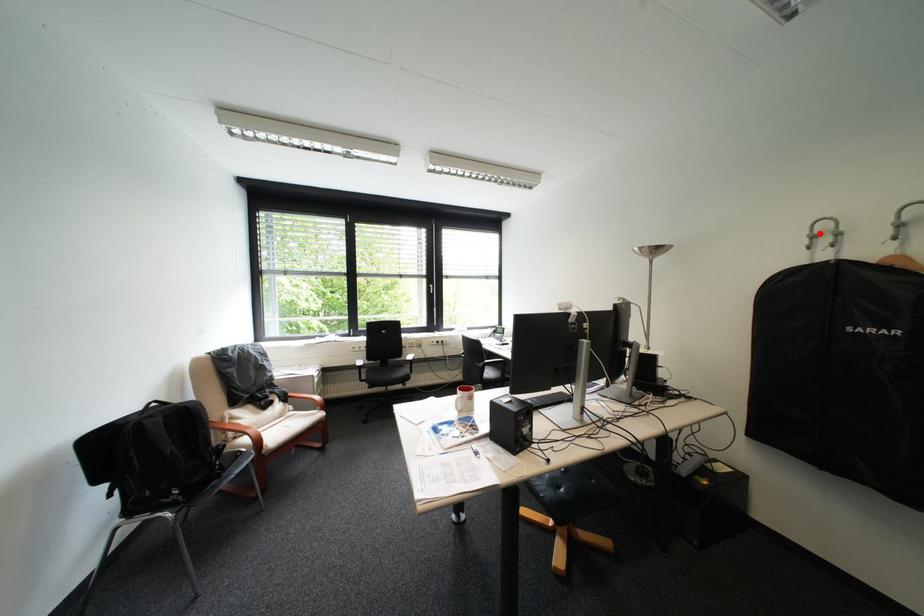
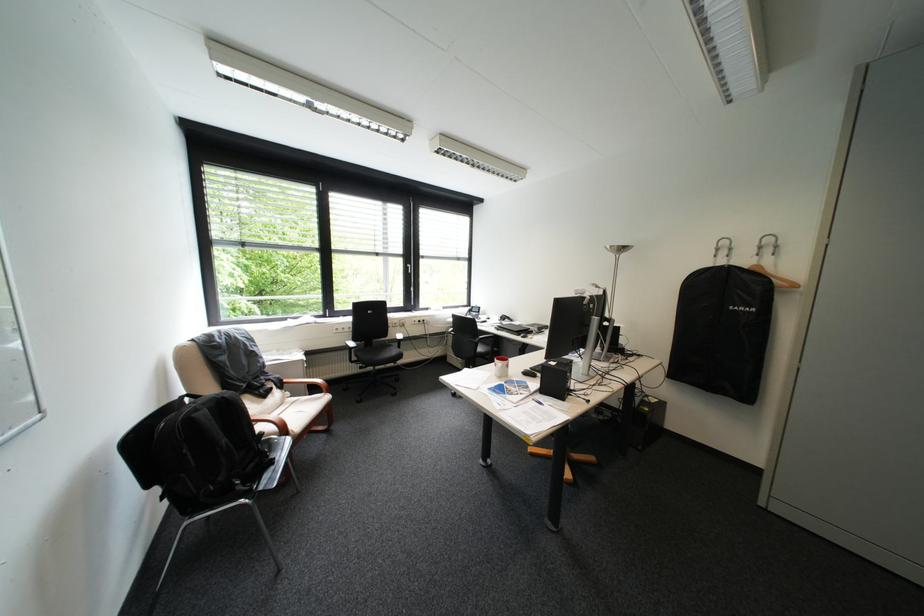
In the second image, find the point that corresponds to the highlighted location in the first image.

(727, 246)